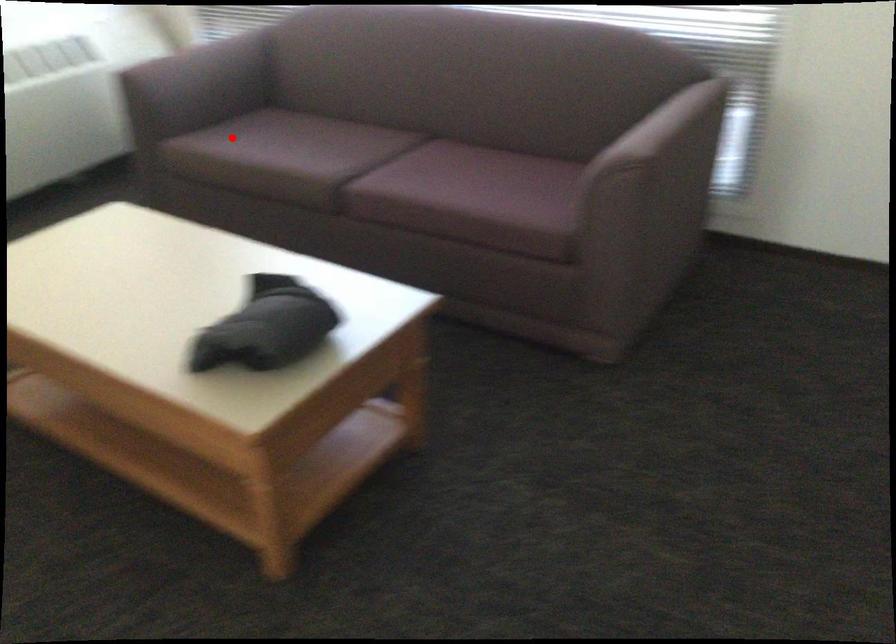
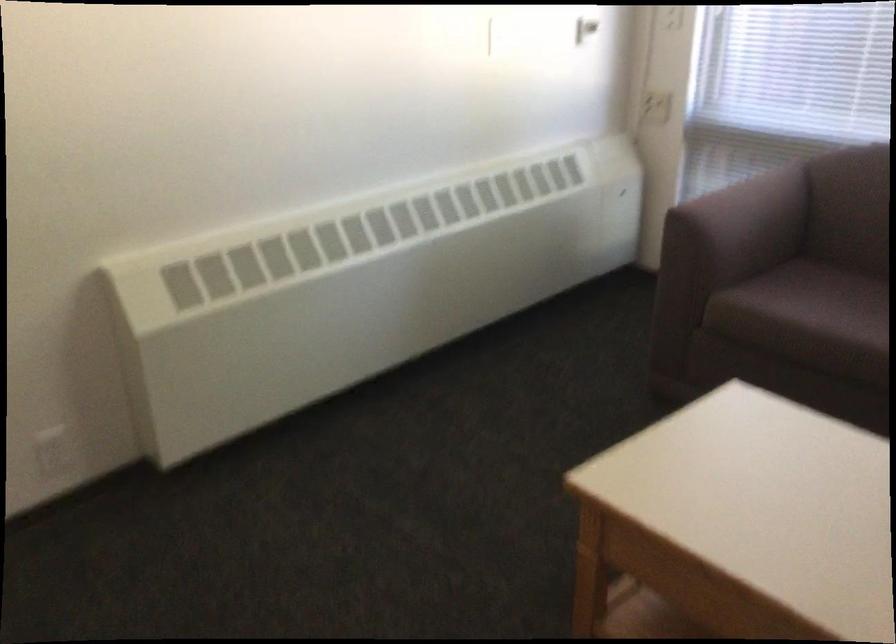
The point at the highlighted location is marked in the first image. Where is the corresponding point in the second image?

(807, 303)